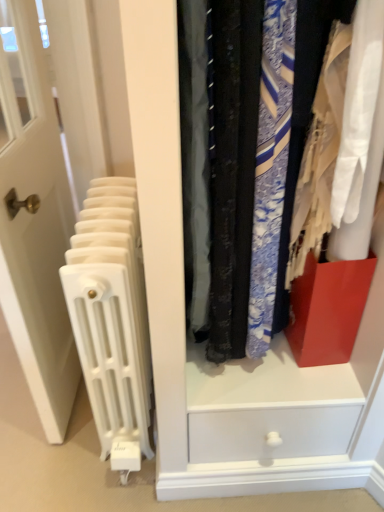
At what (x,y) coordinates should I click in order to perform the action: click on matte plastic drawer at center. Please return your answer as a coordinate pair (x, y). This screenshot has width=384, height=512. Looking at the image, I should click on (243, 359).

Identify the location of white plastic radiator at left. The image size is (384, 512). (111, 316).

Is matte plastic drawer at center looking in the opposite direction of white plastic radiator at left?

No, matte plastic drawer at center is not facing away from white plastic radiator at left.

How much distance is there between matte plastic drawer at center and white plastic radiator at left?

A distance of 10.83 inches exists between matte plastic drawer at center and white plastic radiator at left.

Which of these two, matte plastic drawer at center or white plastic radiator at left, is bigger?

With larger size is matte plastic drawer at center.

Consider the image. Which object is thinner, matte plastic drawer at center or white plastic radiator at left?

With smaller width is matte plastic drawer at center.

Are white glossy door at left and matte plastic drawer at center far apart?

No.

Between white glossy door at left and matte plastic drawer at center, which one appears on the right side from the viewer's perspective?

matte plastic drawer at center.

Is point (8, 16) positioned before point (292, 454)?

Yes, point (8, 16) is in front of point (292, 454).

From the image's perspective, which one is positioned lower, white glossy door at left or matte plastic drawer at center?

white glossy door at left is shown below in the image.

Locate an element on the screen. This screenshot has height=512, width=384. door located in front of the white plastic radiator at left is located at coordinates (34, 220).

How many degrees apart are the facing directions of white plastic radiator at left and white glossy door at left?

There is a 89.1-degree angle between the facing directions of white plastic radiator at left and white glossy door at left.

Is white plastic radiator at left far away from white glossy door at left?

No.

From a real-world perspective, which object rests below the other?

From a 3D spatial view, white plastic radiator at left is below.

Considering the relative sizes of matte plastic drawer at center and white glossy door at left in the image provided, is matte plastic drawer at center taller than white glossy door at left?

No, matte plastic drawer at center is not taller than white glossy door at left.

Does matte plastic drawer at center come in front of white glossy door at left?

Yes, the depth of matte plastic drawer at center is less than that of white glossy door at left.

Between matte plastic drawer at center and white glossy door at left, which one has smaller size?

white glossy door at left.

Where is `door on the left of matte plastic drawer at center`? This screenshot has height=512, width=384. door on the left of matte plastic drawer at center is located at coordinates (34, 220).

Which is nearer, (13, 178) or (61, 281)?

Point (13, 178) is positioned closer to the camera compared to point (61, 281).

From a real-world perspective, who is located higher, white glossy door at left or white plastic radiator at left?

white glossy door at left, from a real-world perspective.

Are white glossy door at left and white plastic radiator at left located far from each other?

No, white glossy door at left is in close proximity to white plastic radiator at left.

Is white glossy door at left thinner than white plastic radiator at left?

Correct, the width of white glossy door at left is less than that of white plastic radiator at left.

Considering the positions of point (123, 419) and point (345, 366), is point (123, 419) closer or farther from the camera than point (345, 366)?

Clearly, point (123, 419) is more distant from the camera than point (345, 366).

How many degrees apart are the facing directions of white plastic radiator at left and matte plastic drawer at center?

The angle between the facing direction of white plastic radiator at left and the facing direction of matte plastic drawer at center is 3.83 degrees.

Could you tell me if white plastic radiator at left is facing matte plastic drawer at center?

No, white plastic radiator at left does not turn towards matte plastic drawer at center.

Which is in front, white plastic radiator at left or matte plastic drawer at center?

matte plastic drawer at center is closer to the camera.

At what (x,y) coordinates should I click in order to perform the action: click on radiator on the left side of matte plastic drawer at center. Please return your answer as a coordinate pair (x, y). Looking at the image, I should click on (111, 316).

This screenshot has width=384, height=512. Identify the location of dresser that appears above the white glossy door at left (from a real-world perspective). (243, 359).

From the image, which object appears to be nearer to white glossy door at left, white plastic radiator at left or matte plastic drawer at center?

The object closer to white glossy door at left is white plastic radiator at left.

From the image, which object appears to be nearer to matte plastic drawer at center, white glossy door at left or white plastic radiator at left?

white plastic radiator at left is closer to matte plastic drawer at center.

From the image, which object appears to be nearer to white plastic radiator at left, white glossy door at left or matte plastic drawer at center?

white glossy door at left.

Looking at this image, looking at the image, which one is located further to white glossy door at left, matte plastic drawer at center or white plastic radiator at left?

matte plastic drawer at center is further to white glossy door at left.

Which object lies nearer to the anchor point matte plastic drawer at center, white plastic radiator at left or white glossy door at left?

white plastic radiator at left is closer to matte plastic drawer at center.

Estimate the real-world distances between objects in this image. Which object is further from white plastic radiator at left, matte plastic drawer at center or white glossy door at left?

Among the two, matte plastic drawer at center is located further to white plastic radiator at left.

At what (x,y) coordinates should I click in order to perform the action: click on radiator between white glossy door at left and matte plastic drawer at center in the horizontal direction. Please return your answer as a coordinate pair (x, y). Looking at the image, I should click on (111, 316).